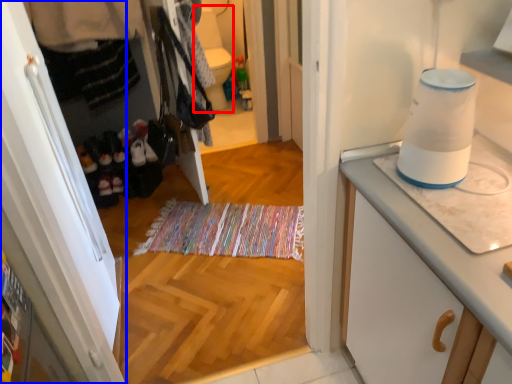
Question: Which object is further to the camera taking this photo, toilet bowl (highlighted by a red box) or cabinetry (highlighted by a blue box)?

Choices:
 (A) toilet bowl
 (B) cabinetry

Answer: (A)